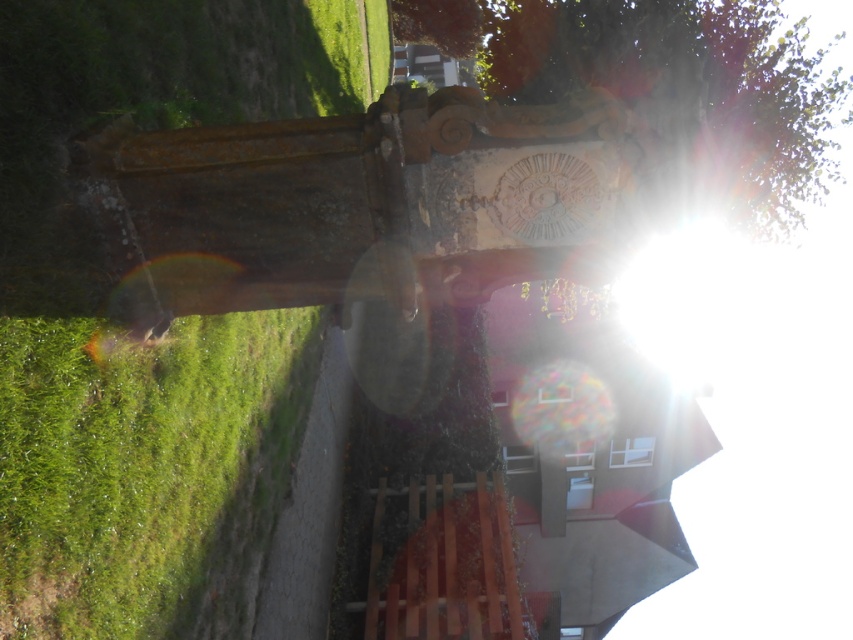
Question: Does green grass at lower left have a larger size compared to green leafy tree at upper center?

Choices:
 (A) yes
 (B) no

Answer: (B)

Question: Is green grass at lower left below green leafy tree at upper center?

Choices:
 (A) yes
 (B) no

Answer: (A)

Question: Can you confirm if green grass at lower left is positioned to the right of green leafy tree at upper center?

Choices:
 (A) yes
 (B) no

Answer: (B)

Question: Which of the following is the farthest from the observer?

Choices:
 (A) (141, 404)
 (B) (624, 99)

Answer: (B)